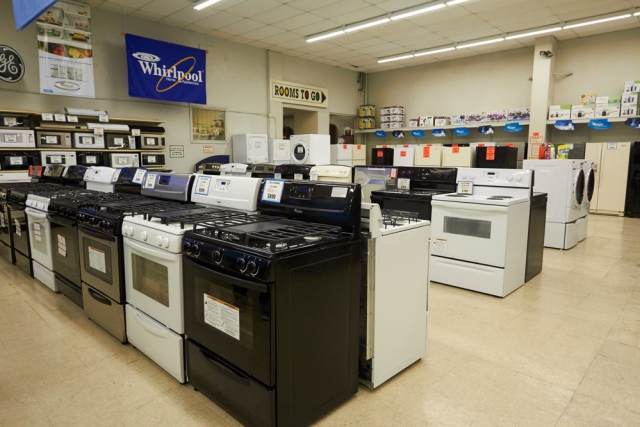
Find the location of a particular element. The image size is (640, 427). lights is located at coordinates (460, 45), (390, 15), (207, 6).